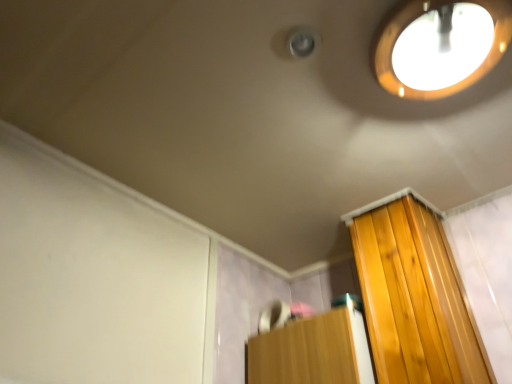
Question: From a real-world perspective, is white matte screen door at upper left physically above matte wooden droplight at upper right?

Choices:
 (A) no
 (B) yes

Answer: (A)

Question: Does white matte screen door at upper left have a greater height compared to matte wooden droplight at upper right?

Choices:
 (A) yes
 (B) no

Answer: (A)

Question: Can you confirm if white matte screen door at upper left is thinner than matte wooden droplight at upper right?

Choices:
 (A) no
 (B) yes

Answer: (B)

Question: Is white matte screen door at upper left shorter than matte wooden droplight at upper right?

Choices:
 (A) yes
 (B) no

Answer: (B)

Question: Are white matte screen door at upper left and matte wooden droplight at upper right making contact?

Choices:
 (A) no
 (B) yes

Answer: (A)

Question: Can you confirm if white matte screen door at upper left is positioned to the left of matte wooden droplight at upper right?

Choices:
 (A) yes
 (B) no

Answer: (A)

Question: Is wooden cabinet at lower right to the right of white matte screen door at upper left from the viewer's perspective?

Choices:
 (A) no
 (B) yes

Answer: (B)

Question: Considering the relative positions of wooden cabinet at lower right and white matte screen door at upper left in the image provided, is wooden cabinet at lower right behind white matte screen door at upper left?

Choices:
 (A) yes
 (B) no

Answer: (A)

Question: Are wooden cabinet at lower right and white matte screen door at upper left beside each other?

Choices:
 (A) no
 (B) yes

Answer: (A)

Question: Is wooden cabinet at lower right not inside white matte screen door at upper left?

Choices:
 (A) no
 (B) yes

Answer: (B)

Question: From a real-world perspective, is wooden cabinet at lower right under white matte screen door at upper left?

Choices:
 (A) no
 (B) yes

Answer: (B)

Question: Considering the relative sizes of wooden cabinet at lower right and white matte screen door at upper left in the image provided, is wooden cabinet at lower right taller than white matte screen door at upper left?

Choices:
 (A) yes
 (B) no

Answer: (B)

Question: Considering the relative sizes of matte wooden droplight at upper right and white matte screen door at upper left in the image provided, is matte wooden droplight at upper right wider than white matte screen door at upper left?

Choices:
 (A) no
 (B) yes

Answer: (B)